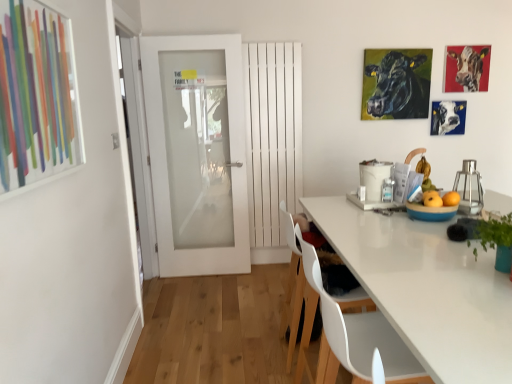
Question: Should I look upward or downward to see black glossy cattle at upper right, the 3th cattle positioned from the right?

Choices:
 (A) up
 (B) down

Answer: (A)

Question: Does black glossy cattle at upper right, the 1th cattle from the left, come behind yellow matte apple at right?

Choices:
 (A) no
 (B) yes

Answer: (B)

Question: Is black glossy cattle at upper right, the 1th cattle from the left, facing towards yellow matte apple at right?

Choices:
 (A) no
 (B) yes

Answer: (B)

Question: Is black glossy cattle at upper right, the 3th cattle positioned from the right, far from yellow matte apple at right?

Choices:
 (A) no
 (B) yes

Answer: (B)

Question: Does black glossy cattle at upper right, the 1th cattle from the left, have a smaller size compared to yellow matte apple at right?

Choices:
 (A) yes
 (B) no

Answer: (B)

Question: Does black glossy cattle at upper right, the 1th cattle from the left, have a greater height compared to yellow matte apple at right?

Choices:
 (A) yes
 (B) no

Answer: (A)

Question: Is black glossy cattle at upper right, the 3th cattle positioned from the right, closer to camera compared to yellow matte apple at right?

Choices:
 (A) yes
 (B) no

Answer: (B)

Question: Is white plastic chair at lower center, which is counted as the second chair, starting from the front, at the right side of metallic glass container at right?

Choices:
 (A) no
 (B) yes

Answer: (A)

Question: Is the depth of white plastic chair at lower center, the 1th chair positioned from the back, less than that of metallic glass container at right?

Choices:
 (A) yes
 (B) no

Answer: (B)

Question: From the image's perspective, is white plastic chair at lower center, the 1th chair positioned from the back, below metallic glass container at right?

Choices:
 (A) no
 (B) yes

Answer: (B)

Question: Is white plastic chair at lower center, the 1th chair positioned from the back, positioned with its back to metallic glass container at right?

Choices:
 (A) yes
 (B) no

Answer: (B)

Question: Is white plastic chair at lower center, which is counted as the second chair, starting from the front, far from metallic glass container at right?

Choices:
 (A) yes
 (B) no

Answer: (B)

Question: Is white plastic chair at lower center, the 1th chair positioned from the back, oriented towards metallic glass container at right?

Choices:
 (A) no
 (B) yes

Answer: (B)

Question: Does metallic glass container at right have a smaller size compared to green glossy plant at right?

Choices:
 (A) no
 (B) yes

Answer: (A)